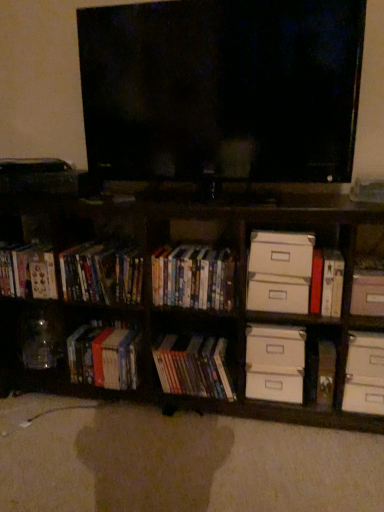
The height and width of the screenshot is (512, 384). I want to click on empty space that is ontop of matte plastic dvds at left, the first cabinet viewed from the left (from a real-world perspective), so click(100, 246).